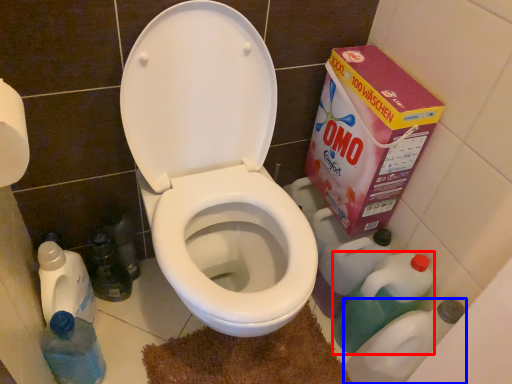
Question: Among these objects, which one is farthest to the camera, cleaning product (highlighted by a red box) or cleaning product (highlighted by a blue box)?

Choices:
 (A) cleaning product
 (B) cleaning product

Answer: (A)